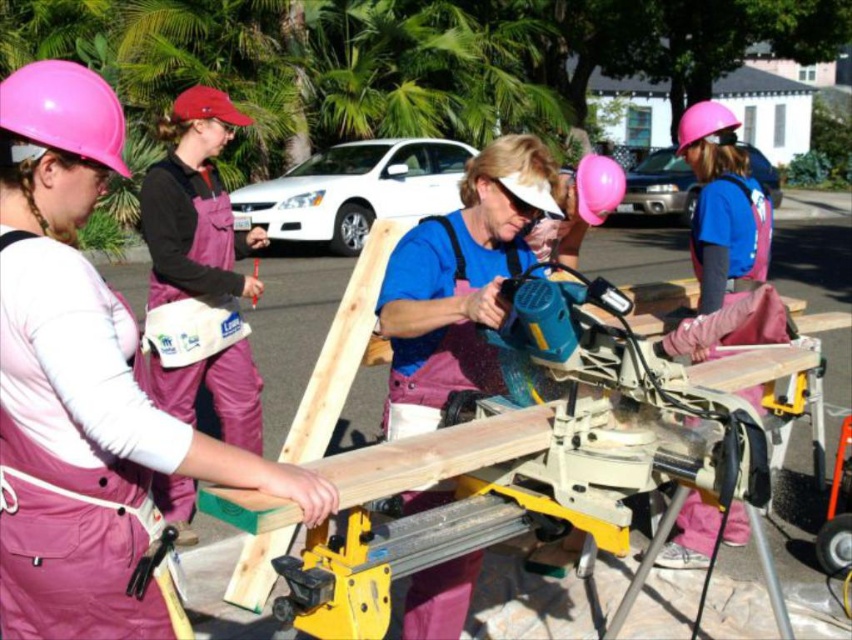
You are a photographer trying to capture a clear shot of both the pink matte helmet at upper left and the pink matte balloon at center. Since you want both objects in focus, you need to know their relative positions. Which object is closer to the camera?

The pink matte helmet at upper left is in front of the pink matte balloon at center, so it is closer to the camera.

You are a photographer trying to capture both the pink fabric apron at upper left and the pink matte balloon at center in the same frame. Which object should you position closer to the camera to ensure both are fully visible?

Since the pink fabric apron at upper left is not as tall as the pink matte balloon at center, you should position the pink fabric apron at upper left closer to the camera to ensure both objects are fully visible in the frame.

From the picture: You are a participant in the woodworking activity and need to retrieve your pink fabric apron at upper left and pink matte helmet at upper center. Which item is easier to reach without moving your current position?

The pink fabric apron at upper left is closer to the viewer than the pink matte helmet at upper center, so it is easier to reach without moving.